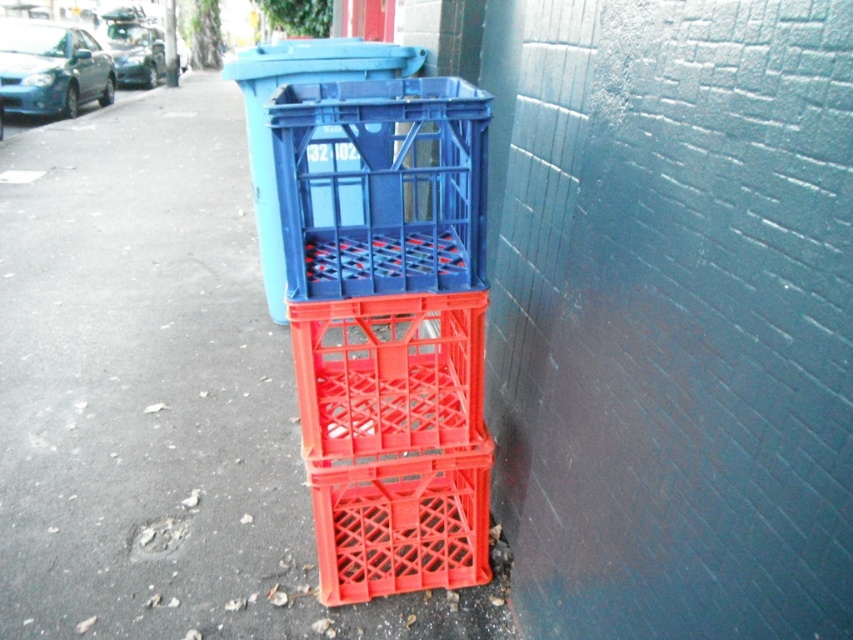
Question: In this image, where is matte plastic crates at center located relative to blue plastic recycling bin at center?

Choices:
 (A) above
 (B) below

Answer: (B)

Question: In this image, where is matte plastic crates at center located relative to blue plastic recycling bin at center?

Choices:
 (A) left
 (B) right

Answer: (A)

Question: Observing the image, what is the correct spatial positioning of matte plastic crates at center in reference to blue plastic recycling bin at center?

Choices:
 (A) above
 (B) below

Answer: (B)